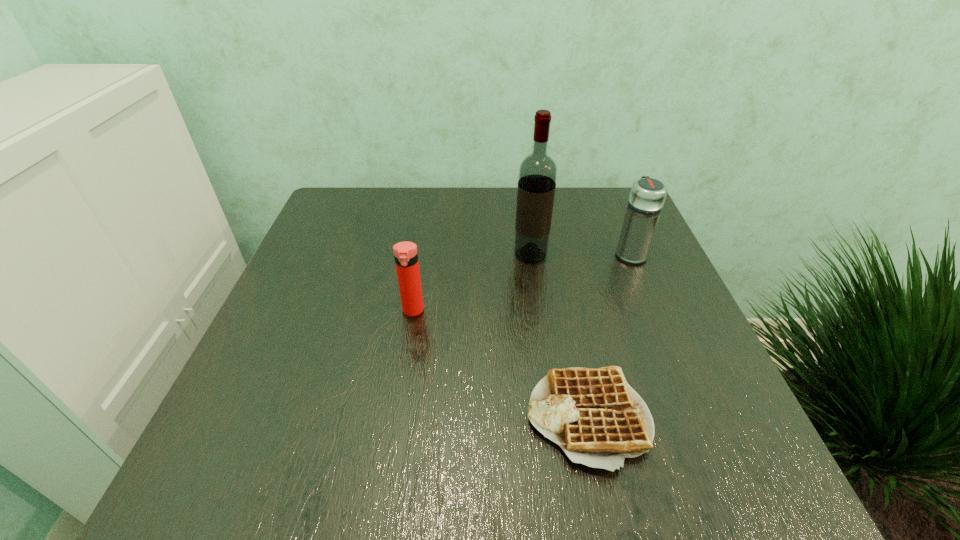
Locate an element on the screen. free space located 0.090m with a handle on the side of the right thermos bottle is located at coordinates (617, 221).

Where is `free space located on the left of the second nearest object`? free space located on the left of the second nearest object is located at coordinates (300, 311).

Locate an element on the screen. vacant space located 0.240m on the back of the nearest object is located at coordinates (560, 281).

What are the coordinates of `object that is at the near edge` in the screenshot? It's located at (594, 415).

This screenshot has width=960, height=540. Identify the location of thermos bottle present at the right edge. (647, 196).

Find the location of a particular element. Image resolution: width=960 pixels, height=540 pixels. waffle that is at the right edge is located at coordinates (594, 415).

This screenshot has height=540, width=960. I want to click on object at the near right corner, so click(594, 415).

This screenshot has height=540, width=960. I want to click on free space at the far edge of the desktop, so click(484, 228).

In the image, there is a desktop. Identify the location of vacant space at the near edge. (422, 447).

I want to click on vacant space at the left edge of the desktop, so click(x=327, y=243).